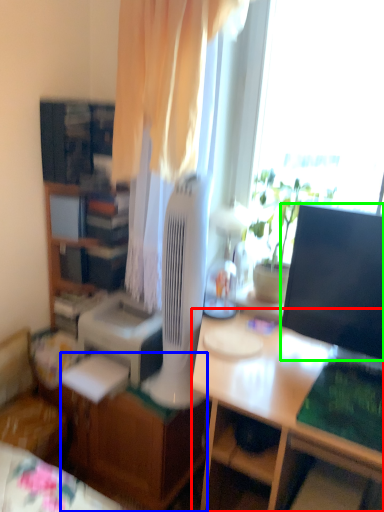
Question: Which object is positioned closest to desk (highlighted by a red box)? Select from desk (highlighted by a blue box) and television (highlighted by a green box).

Choices:
 (A) desk
 (B) television

Answer: (B)